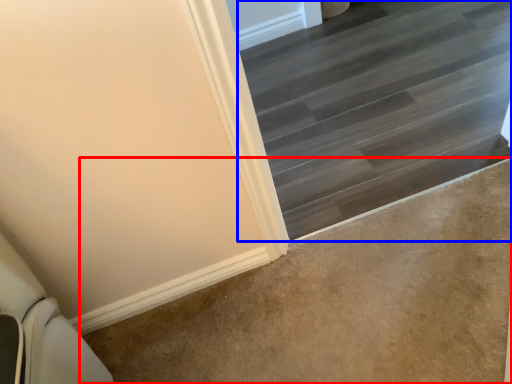
Question: Which object is further to the camera taking this photo, concrete (highlighted by a red box) or stairs (highlighted by a blue box)?

Choices:
 (A) concrete
 (B) stairs

Answer: (B)